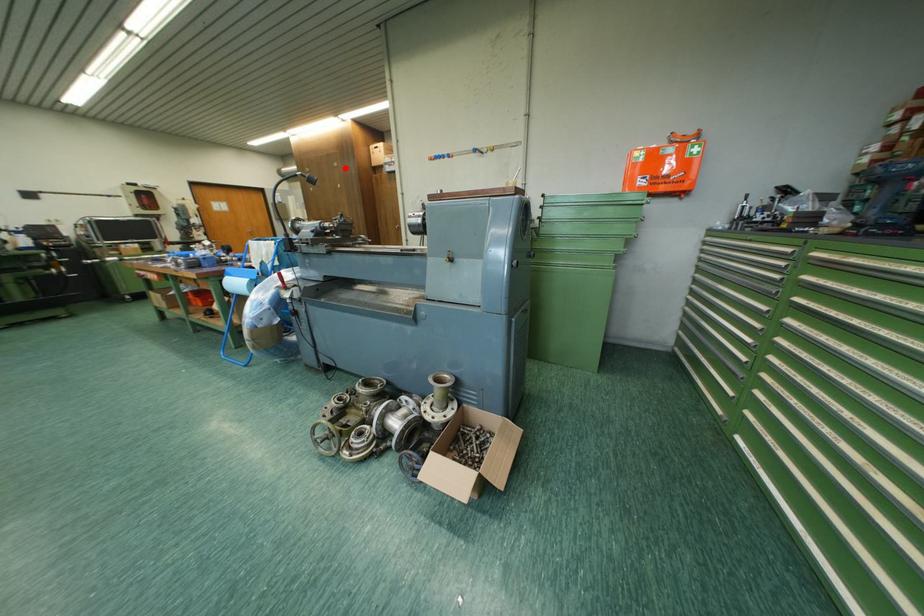
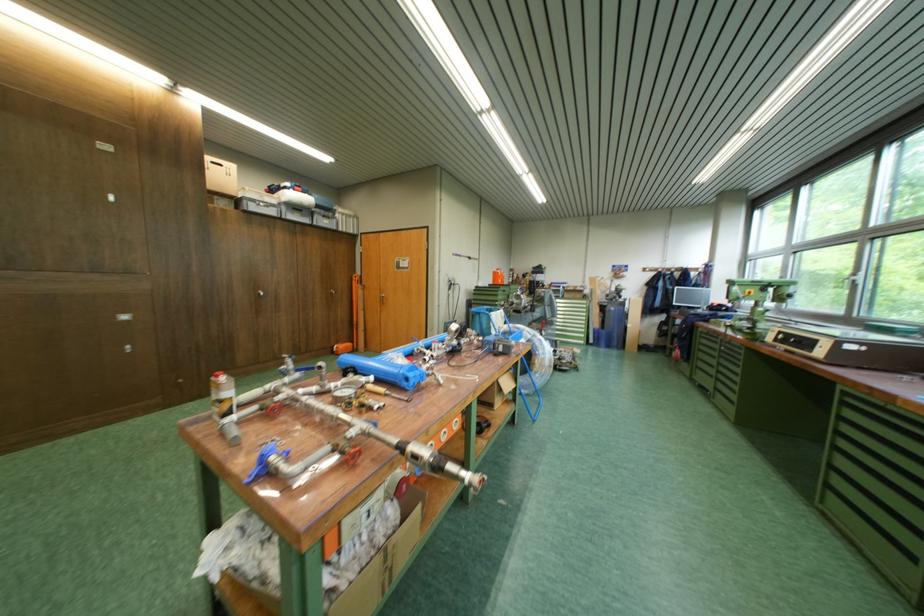
The point at the highlighted location is marked in the first image. Where is the corresponding point in the second image?

(110, 150)